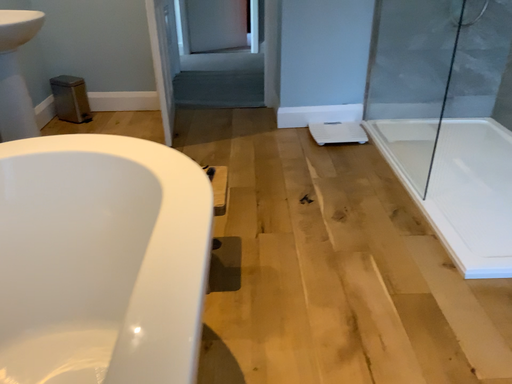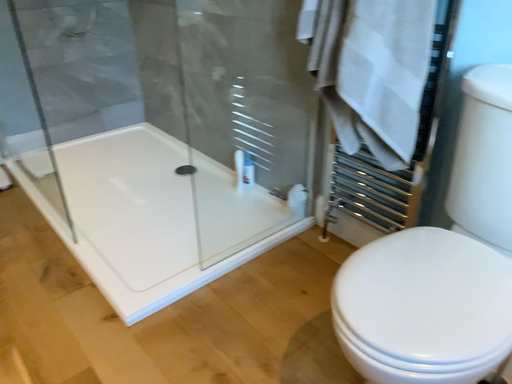
Question: Which way did the camera rotate in the video?

Choices:
 (A) rotated left
 (B) rotated right

Answer: (B)